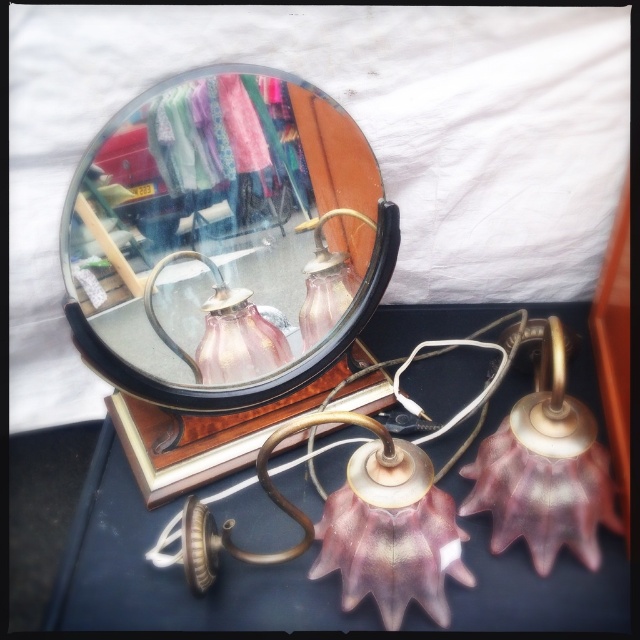
Question: Which point appears farthest from the camera in this image?

Choices:
 (A) (172, 257)
 (B) (321, 253)
 (C) (580, 451)
 (D) (314, 332)

Answer: (D)

Question: Which point is farther to the camera?

Choices:
 (A) matte glass mirror at upper left
 (B) pink glass lamp at center

Answer: (B)

Question: Is pink glass lampshade at lower right to the right of pink glass table lamp at center from the viewer's perspective?

Choices:
 (A) no
 (B) yes

Answer: (B)

Question: Is matte glass mirror at upper left wider than pink glass table lamp at upper center?

Choices:
 (A) yes
 (B) no

Answer: (A)

Question: Which is nearer to the pink glass table lamp at center?

Choices:
 (A) matte glass mirror at upper left
 (B) pink glass lamp at center

Answer: (A)

Question: Can you confirm if pink glass lampshade at lower right is thinner than pink glass table lamp at upper center?

Choices:
 (A) yes
 (B) no

Answer: (B)